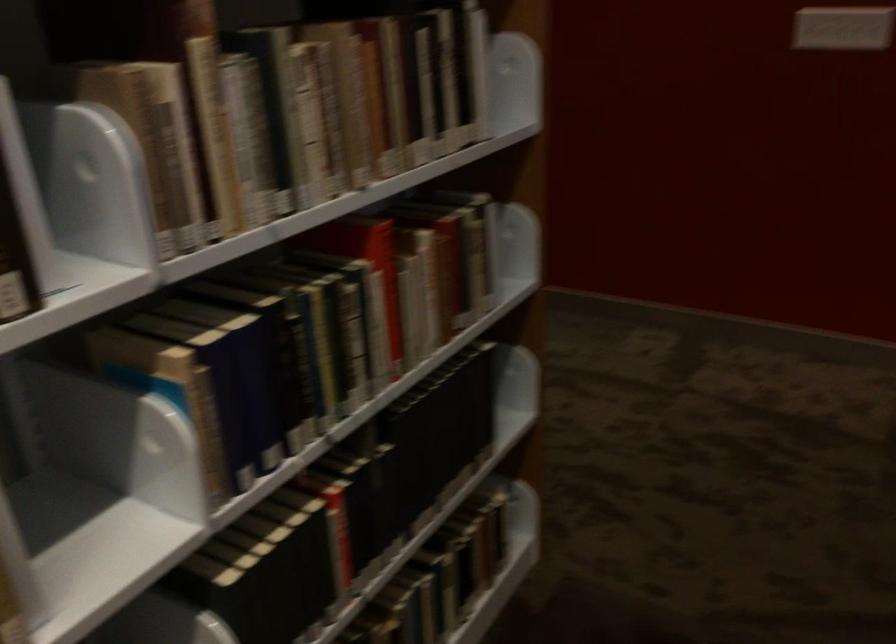
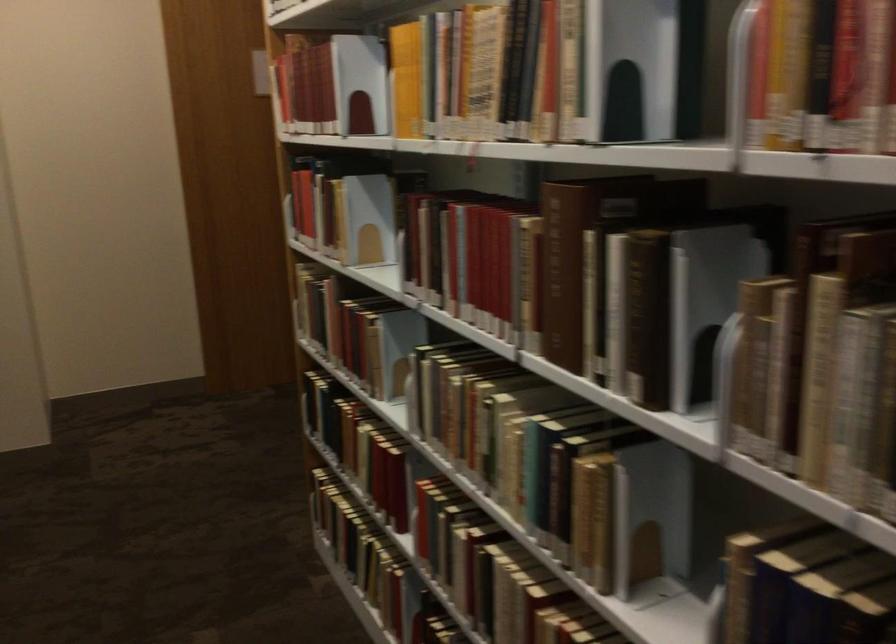
In the second image, find the point that corresponds to the point at 216,120 in the first image.

(817, 366)